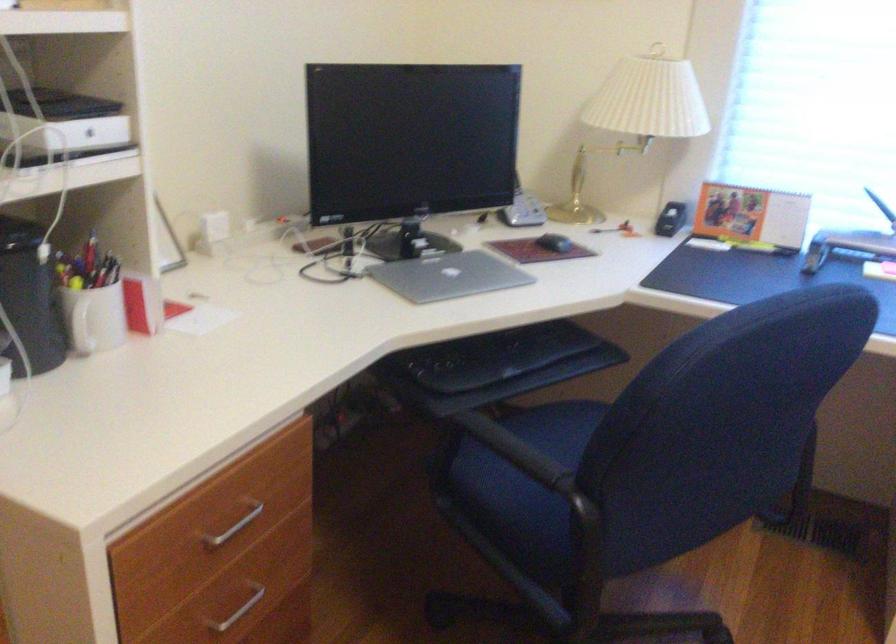
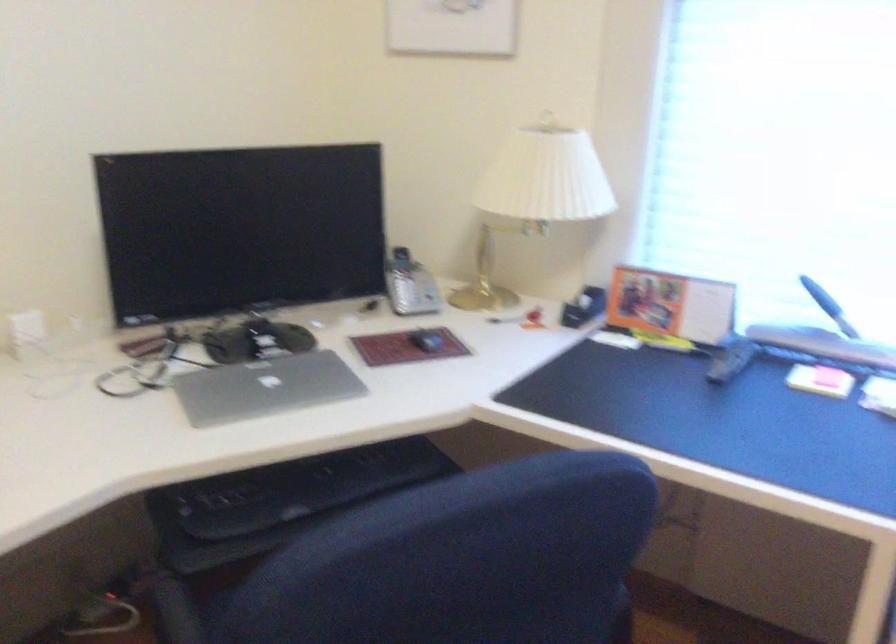
Question: The images are taken continuously from a first-person perspective. In which direction is your viewpoint rotating?

Choices:
 (A) Left
 (B) Right
 (C) Up
 (D) Down

Answer: (A)